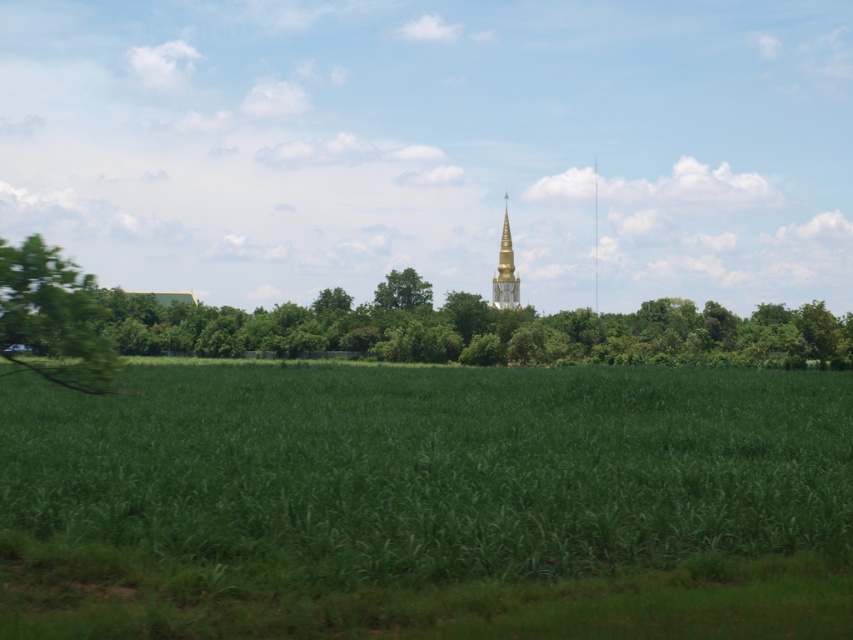
You are standing at the edge of a rural landscape with crops and a distant golden stupa. You want to place a small garden ornament exactly where the green grass at center is located. What are the coordinates where you should place it?

The coordinates for placing the garden ornament at the green grass at center are point (427, 502).

You are a gardener who needs to water both the green grass at center and the green leafy tree at left. Your watering can has a capacity of 5 liters and you can carry it 10 meters before needing to refill. Can you water both without refilling?

The distance between the green grass at center and the green leafy tree at left is 9.60 meters, which is within the 10 meter range your watering can allows. Therefore, you can water both without needing to refill.